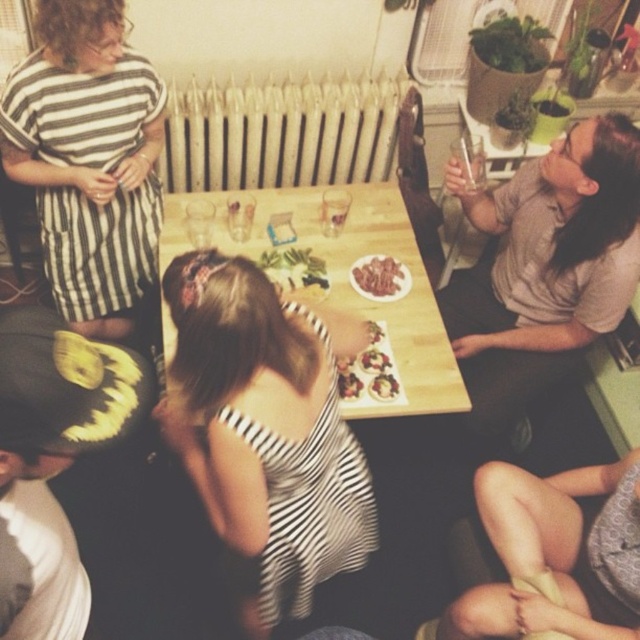
From the picture: Does striped fabric dress at upper left have a smaller size compared to black matte pumpkin at lower left?

No, striped fabric dress at upper left is not smaller than black matte pumpkin at lower left.

Does striped fabric dress at upper left have a larger size compared to black matte pumpkin at lower left?

Yes, striped fabric dress at upper left is bigger than black matte pumpkin at lower left.

Locate an element on the screen. The width and height of the screenshot is (640, 640). striped fabric dress at upper left is located at coordinates (88, 160).

Does black matte pumpkin at lower left appear on the left side of wooden table at center?

Indeed, black matte pumpkin at lower left is positioned on the left side of wooden table at center.

Does point (51, 538) come behind point (317, 192)?

No, it is not.

Where is `black matte pumpkin at lower left`? The width and height of the screenshot is (640, 640). black matte pumpkin at lower left is located at coordinates (52, 460).

Does point (637, 515) lie behind point (392, 376)?

No, (637, 515) is closer to viewer.

Can you confirm if skinny jeans at lower right is positioned above shiny chocolate cake at center?

Incorrect, skinny jeans at lower right is not positioned above shiny chocolate cake at center.

Between point (465, 609) and point (385, 385), which one is positioned behind?

The point (385, 385) is more distant.

Where is `skinny jeans at lower right`? skinny jeans at lower right is located at coordinates (554, 552).